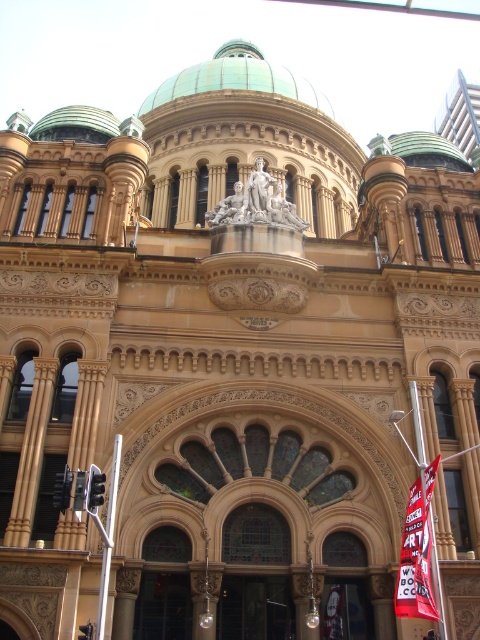
You are an architect visiting this historical building. You notice the red fabric banner at lower right and the green copper dome at upper center. Which object is located to the right of the other?

The red fabric banner at lower right is positioned on the right side of green copper dome at upper center.

You are standing in front of the grand building and notice the red fabric banner at lower right and the green copper dome at upper center. Which object is closer to the ground?

The red fabric banner at lower right is closer to the ground because it is positioned under the green copper dome at upper center.

You are standing in front of the grand building and notice two points marked on the facade. The first point is at coordinate point [417,545] and the second is at point [82,113]. From your perspective, which point appears closer to you?

Point [417,545] is in front of point [82,113], so it appears closer to you.